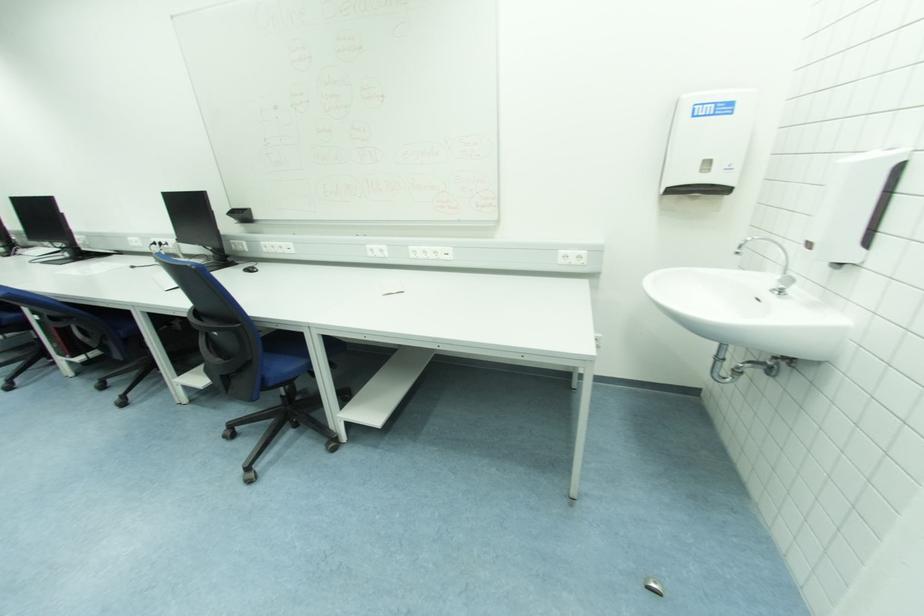
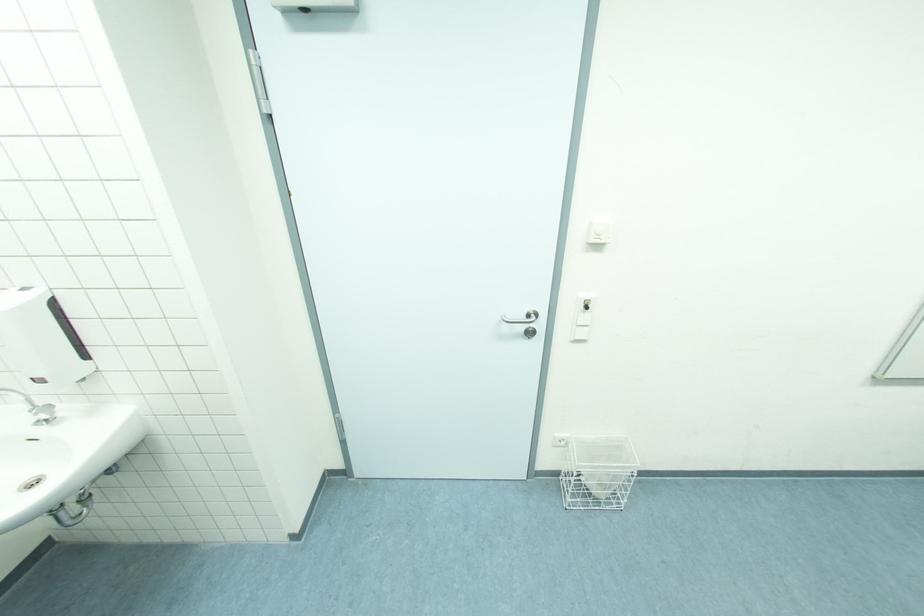
Based on the continuous images, in which direction is the camera rotating?

The rotation direction of the camera is right-down.